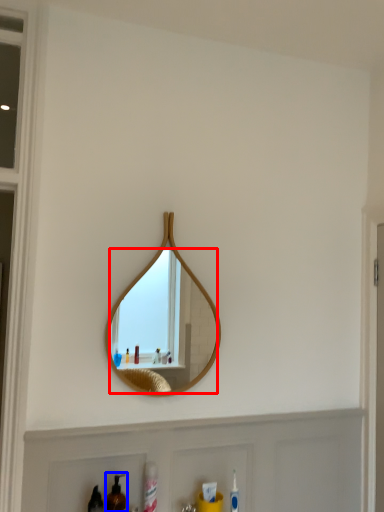
Question: Which point is closer to the camera, mirror (highlighted by a red box) or mouthwash (highlighted by a blue box)?

Choices:
 (A) mirror
 (B) mouthwash

Answer: (B)